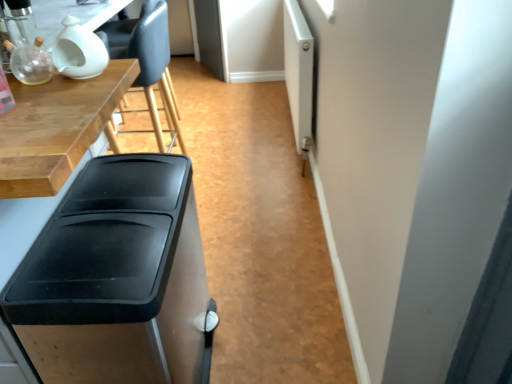
What is the approximate height of black plastic waste container at lower left?

black plastic waste container at lower left is 25.81 inches in height.

The image size is (512, 384). Find the location of `black plastic waste container at lower left`. black plastic waste container at lower left is located at coordinates (117, 278).

What do you see at coordinates (117, 278) in the screenshot? The image size is (512, 384). I see `black plastic waste container at lower left` at bounding box center [117, 278].

Image resolution: width=512 pixels, height=384 pixels. I want to click on black plastic waste container at lower left, so click(x=117, y=278).